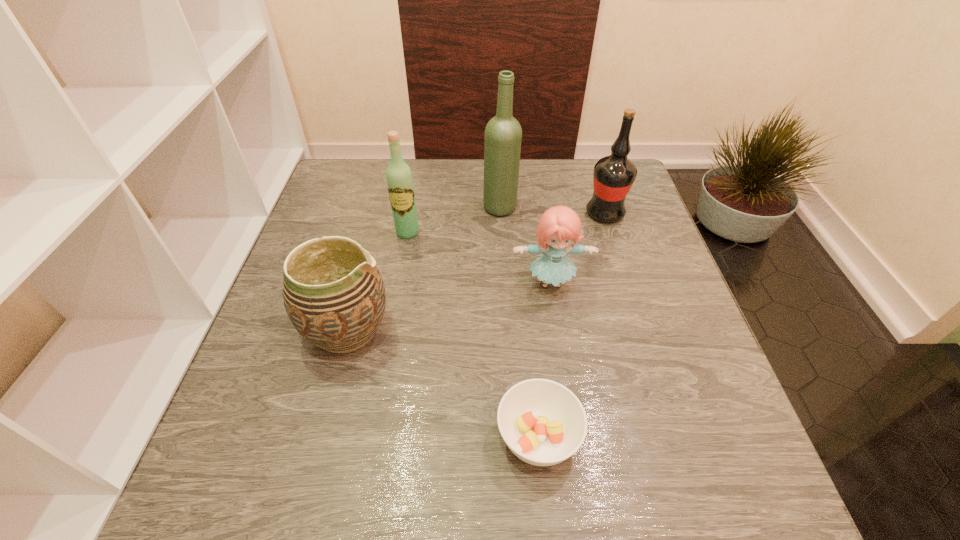
This screenshot has height=540, width=960. I want to click on the second wine bottle from right to left, so click(x=503, y=134).

I want to click on the tallest wine bottle, so click(503, 134).

Image resolution: width=960 pixels, height=540 pixels. Identify the location of the rightmost wine bottle. (613, 176).

Find the location of a particular element. the leftmost wine bottle is located at coordinates (399, 178).

Find the location of `doll`. doll is located at coordinates pos(559,226).

Where is `pottery`? pottery is located at coordinates (333, 293).

Find the location of `the shortest object`. the shortest object is located at coordinates (542, 422).

At what (x,y) coordinates should I click in order to perform the action: click on soup bowl. Please return your answer as a coordinate pair (x, y). Looking at the image, I should click on (542, 422).

This screenshot has width=960, height=540. Identify the location of vacant position located on the right of the tallest object. (608, 207).

Locate an element on the screen. The image size is (960, 540). vacant space situated 0.210m on the back of the rightmost wine bottle is located at coordinates [588, 162].